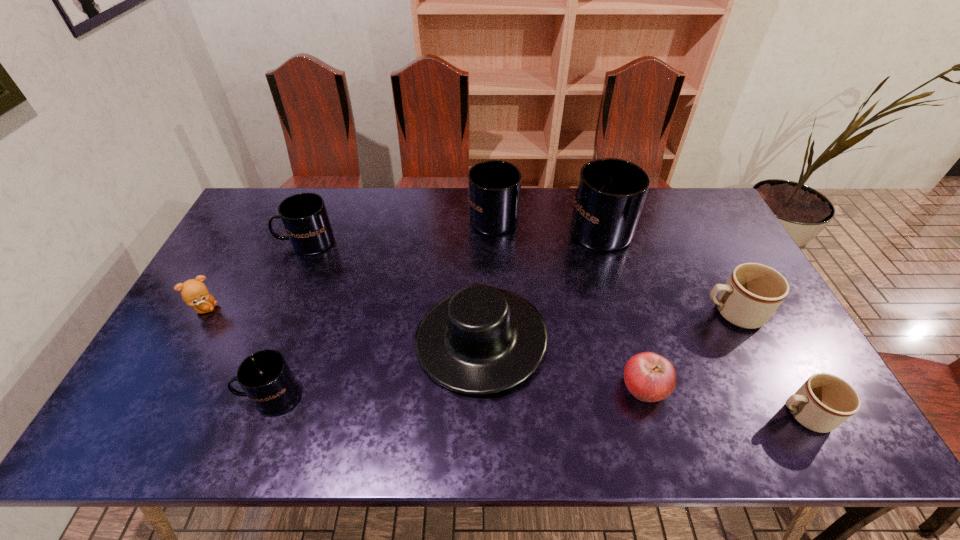
At what (x,y) coordinates should I click in order to perform the action: click on blank space located 0.100m with the handle on the side of the nearest black mug. Please return your answer as a coordinate pair (x, y). Image resolution: width=960 pixels, height=540 pixels. Looking at the image, I should click on (201, 394).

I want to click on free point located 0.250m with the handle on the side of the nearest black mug, so click(138, 394).

At what (x,y) coordinates should I click in order to perform the action: click on blank area located 0.230m on the back of the apple. Please return your answer as a coordinate pair (x, y). The height and width of the screenshot is (540, 960). Looking at the image, I should click on (619, 298).

In order to click on free space located on the side of the smaller brown mug with the handle in this screenshot , I will do [x=636, y=415].

Where is `vacant space located 0.060m on the side of the smaller brown mug with the handle`? vacant space located 0.060m on the side of the smaller brown mug with the handle is located at coordinates (748, 415).

You are a GUI agent. You are given a task and a screenshot of the screen. Output one action in this format:
    pyautogui.click(x=<x>, y=<y>)
    Task: Click on the vacant area located on the side of the smaller brown mug with the handle
    Image resolution: width=960 pixels, height=540 pixels.
    Given the screenshot: What is the action you would take?
    pyautogui.click(x=680, y=415)

The width and height of the screenshot is (960, 540). Identify the location of object that is positioned at the left edge. (194, 293).

The height and width of the screenshot is (540, 960). In order to click on object located at the near right corner in this screenshot , I will do `click(824, 401)`.

The image size is (960, 540). Identify the location of vacant region at the far edge. (649, 215).

In order to click on free space at the near edge in this screenshot , I will do `click(345, 436)`.